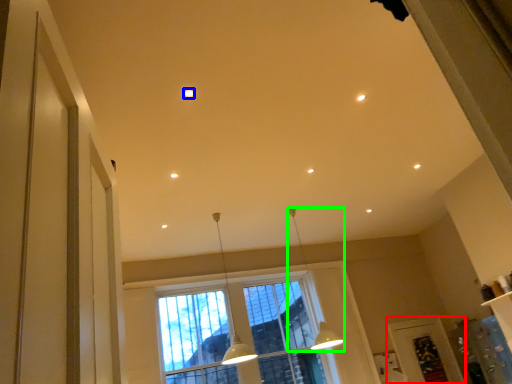
Question: Which is farther away from screen door (highlighted by a red box)? lighting (highlighted by a blue box) or lamp (highlighted by a green box)?

Choices:
 (A) lighting
 (B) lamp

Answer: (A)